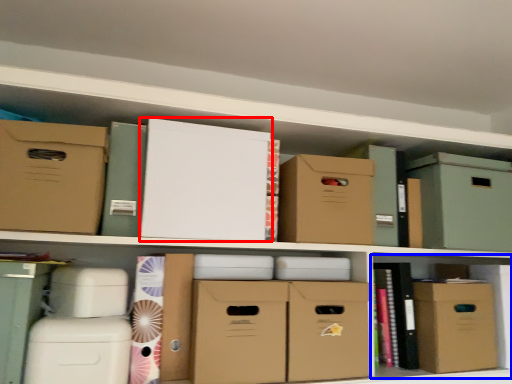
Question: Which object is closer to the camera taking this photo, cardboard box (highlighted by a red box) or cabinet (highlighted by a blue box)?

Choices:
 (A) cardboard box
 (B) cabinet

Answer: (A)